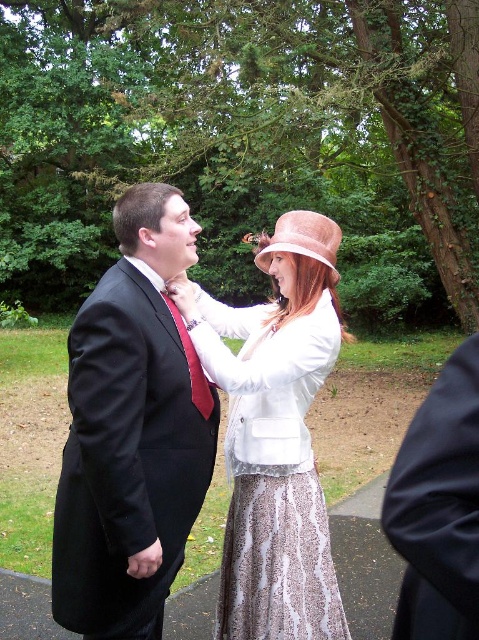
Between matte black suit at center and shiny white jacket at center, which one appears on the left side from the viewer's perspective?

matte black suit at center is more to the left.

Looking at this image, between matte black suit at center and shiny white jacket at center, which one is positioned lower?

Positioned lower is shiny white jacket at center.

Between point (173, 248) and point (294, 236), which one is positioned behind?

Point (294, 236)

You are a GUI agent. You are given a task and a screenshot of the screen. Output one action in this format:
    pyautogui.click(x=<x>, y=<y>)
    Task: Click on the matte black suit at center
    This screenshot has height=640, width=479.
    Given the screenshot: What is the action you would take?
    click(x=132, y=432)

Does point (287, 513) come farther from viewer compared to point (274, 237)?

No, (287, 513) is in front of (274, 237).

Does point (226, 384) lie in front of point (272, 243)?

Yes, point (226, 384) is in front of point (272, 243).

Is point (230, 364) positioned behind point (332, 252)?

No.

At what (x,y) coordinates should I click in order to perform the action: click on shiny white jacket at center. Please return your answer as a coordinate pair (x, y). Looking at the image, I should click on (274, 435).

Does shiny white jacket at center appear over black fabric coat at lower right?

No.

Does shiny white jacket at center have a lesser width compared to black fabric coat at lower right?

No.

You are a GUI agent. You are given a task and a screenshot of the screen. Output one action in this format:
    pyautogui.click(x=<x>, y=<y>)
    Task: Click on the shiny white jacket at center
    The image size is (479, 640).
    Given the screenshot: What is the action you would take?
    pyautogui.click(x=274, y=435)